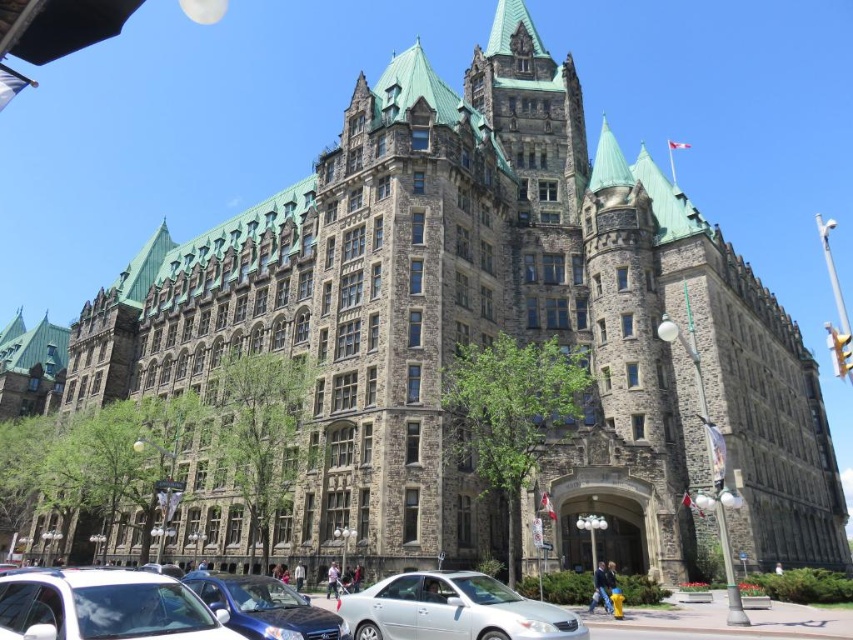
Question: Which object is positioned closest to the metallic blue sedan at center?

Choices:
 (A) white glossy sedan at lower left
 (B) silver metallic sedan at center

Answer: (B)

Question: Which point is farther to the camera?

Choices:
 (A) (332, 616)
 (B) (361, 634)

Answer: (B)

Question: Does white glossy sedan at lower left have a smaller size compared to silver metallic sedan at center?

Choices:
 (A) no
 (B) yes

Answer: (B)

Question: Does white glossy sedan at lower left have a smaller size compared to silver metallic sedan at center?

Choices:
 (A) no
 (B) yes

Answer: (B)

Question: Which point is farther to the camera?

Choices:
 (A) silver metallic sedan at center
 (B) metallic blue sedan at center

Answer: (A)

Question: Does silver metallic sedan at center have a greater width compared to metallic blue sedan at center?

Choices:
 (A) yes
 (B) no

Answer: (A)